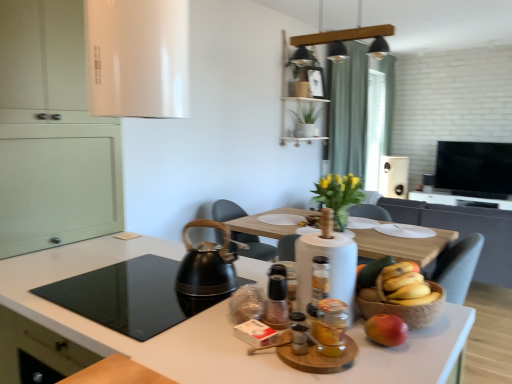
Question: Does matte white vase at center have a smaller size compared to green fabric curtain at upper center?

Choices:
 (A) yes
 (B) no

Answer: (A)

Question: Considering the relative sizes of matte white vase at center and green fabric curtain at upper center in the image provided, is matte white vase at center taller than green fabric curtain at upper center?

Choices:
 (A) no
 (B) yes

Answer: (A)

Question: Can you confirm if matte white vase at center is thinner than green fabric curtain at upper center?

Choices:
 (A) no
 (B) yes

Answer: (B)

Question: Considering the relative sizes of matte white vase at center and green fabric curtain at upper center in the image provided, is matte white vase at center wider than green fabric curtain at upper center?

Choices:
 (A) yes
 (B) no

Answer: (B)

Question: Is matte white vase at center at the right side of green fabric curtain at upper center?

Choices:
 (A) no
 (B) yes

Answer: (A)

Question: Considering the positions of translucent glass jar at center, positioned as the first bottle in front-to-back order, and black glass cooktop at lower left in the image, is translucent glass jar at center, positioned as the first bottle in front-to-back order, bigger or smaller than black glass cooktop at lower left?

Choices:
 (A) big
 (B) small

Answer: (B)

Question: In the image, is translucent glass jar at center, the third bottle positioned from the back, on the left side or the right side of black glass cooktop at lower left?

Choices:
 (A) left
 (B) right

Answer: (B)

Question: Considering the positions of translucent glass jar at center, the third bottle positioned from the back, and black glass cooktop at lower left in the image, is translucent glass jar at center, the third bottle positioned from the back, taller or shorter than black glass cooktop at lower left?

Choices:
 (A) short
 (B) tall

Answer: (B)

Question: Does point (329, 334) appear closer or farther from the camera than point (98, 317)?

Choices:
 (A) closer
 (B) farther

Answer: (A)

Question: Does point (211, 243) appear closer or farther from the camera than point (410, 266)?

Choices:
 (A) closer
 (B) farther

Answer: (B)

Question: Is black matte tea kettle at center wider or thinner than yellow matte bananas at center, positioned as the first banana in back-to-front order?

Choices:
 (A) thin
 (B) wide

Answer: (B)

Question: Visually, is black matte tea kettle at center positioned to the left or to the right of yellow matte bananas at center, positioned as the first banana in back-to-front order?

Choices:
 (A) left
 (B) right

Answer: (A)

Question: Based on their sizes in the image, would you say black matte tea kettle at center is bigger or smaller than yellow matte bananas at center, positioned as the first banana in back-to-front order?

Choices:
 (A) big
 (B) small

Answer: (A)

Question: Is yellow matte bananas at center, positioned as the first banana in back-to-front order, in front of or behind translucent glass jar at center, the 2th bottle when ordered from back to front, in the image?

Choices:
 (A) front
 (B) behind

Answer: (B)

Question: From the image's perspective, is yellow matte bananas at center, which is the second banana in front-to-back order, located above or below translucent glass jar at center, the 2th bottle when ordered from back to front?

Choices:
 (A) below
 (B) above

Answer: (A)